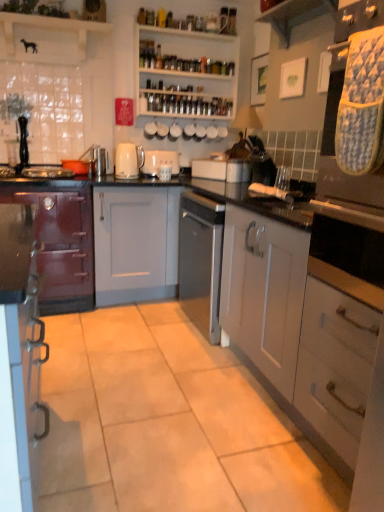
Question: Is wooden shelf at upper center, positioned as the 2th shelf in back-to-front order, aimed at white matte toaster at center, which appears as the 2th appliance when ordered from the bottom?

Choices:
 (A) yes
 (B) no

Answer: (B)

Question: Can you confirm if wooden shelf at upper center, which appears as the first shelf when viewed from the front, is shorter than white matte toaster at center, placed as the 1th appliance when sorted from back to front?

Choices:
 (A) yes
 (B) no

Answer: (A)

Question: Is wooden shelf at upper center, acting as the second shelf starting from the right, positioned in front of white matte toaster at center, which is the first appliance from top to bottom?

Choices:
 (A) yes
 (B) no

Answer: (A)

Question: Is wooden shelf at upper center, which appears as the first shelf when viewed from the front, further to camera compared to white matte toaster at center, positioned as the second appliance in right-to-left order?

Choices:
 (A) no
 (B) yes

Answer: (A)

Question: Is wooden shelf at upper center, acting as the second shelf starting from the right, turned away from white matte toaster at center, which is the first appliance from top to bottom?

Choices:
 (A) no
 (B) yes

Answer: (A)

Question: Considering the positions of matte burgundy cabinet at left, which ranks as the 1th cabinetry in left-to-right order, and white glossy shelves at upper center, the second shelf when ordered from front to back, in the image, is matte burgundy cabinet at left, which ranks as the 1th cabinetry in left-to-right order, bigger or smaller than white glossy shelves at upper center, the second shelf when ordered from front to back,?

Choices:
 (A) big
 (B) small

Answer: (A)

Question: From a real-world perspective, is matte burgundy cabinet at left, which ranks as the 1th cabinetry in left-to-right order, above or below white glossy shelves at upper center, the 1th shelf from the right?

Choices:
 (A) above
 (B) below

Answer: (B)

Question: Considering the relative positions of matte burgundy cabinet at left, the third cabinetry positioned from the right, and white glossy shelves at upper center, the 1th shelf from the right, in the image provided, is matte burgundy cabinet at left, the third cabinetry positioned from the right, to the left or to the right of white glossy shelves at upper center, the 1th shelf from the right,?

Choices:
 (A) left
 (B) right

Answer: (A)

Question: Does point tap(49, 210) appear closer or farther from the camera than point tap(226, 42)?

Choices:
 (A) farther
 (B) closer

Answer: (B)

Question: From their relative heights in the image, would you say white matte cabinet at center, which ranks as the first cabinetry in right-to-left order, is taller or shorter than satin silver toaster at center, the second appliance when ordered from back to front?

Choices:
 (A) tall
 (B) short

Answer: (A)

Question: Considering the positions of white matte cabinet at center, marked as the 3th cabinetry in a left-to-right arrangement, and satin silver toaster at center, placed as the second appliance when sorted from top to bottom, in the image, is white matte cabinet at center, marked as the 3th cabinetry in a left-to-right arrangement, wider or thinner than satin silver toaster at center, placed as the second appliance when sorted from top to bottom,?

Choices:
 (A) wide
 (B) thin

Answer: (A)

Question: Relative to satin silver toaster at center, marked as the first appliance in a front-to-back arrangement, is white matte cabinet at center, marked as the 3th cabinetry in a left-to-right arrangement, in front or behind?

Choices:
 (A) front
 (B) behind

Answer: (A)

Question: From a real-world perspective, is white matte cabinet at center, marked as the 3th cabinetry in a left-to-right arrangement, physically located above or below satin silver toaster at center, marked as the first appliance in a front-to-back arrangement?

Choices:
 (A) below
 (B) above

Answer: (A)

Question: Looking at the image, does satin silver toaster at center, which is the 1th appliance from bottom to top, seem bigger or smaller compared to white matte cabinet at center, marked as the 3th cabinetry in a left-to-right arrangement?

Choices:
 (A) big
 (B) small

Answer: (B)

Question: From a real-world perspective, relative to white matte cabinet at center, marked as the 3th cabinetry in a left-to-right arrangement, is satin silver toaster at center, placed as the second appliance when sorted from top to bottom, vertically above or below?

Choices:
 (A) below
 (B) above

Answer: (B)